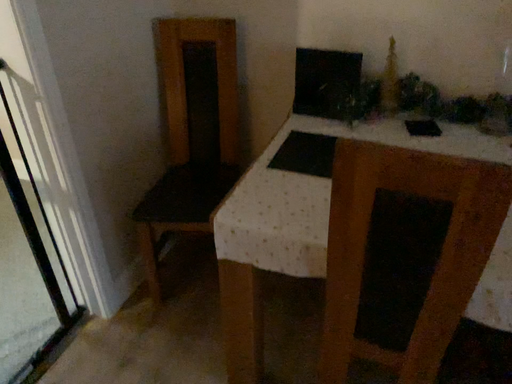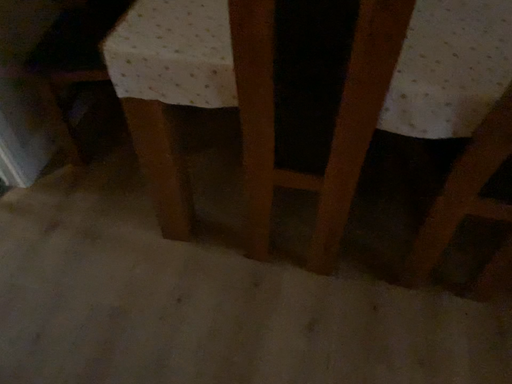
Question: Which way did the camera rotate in the video?

Choices:
 (A) rotated upward
 (B) rotated downward

Answer: (B)